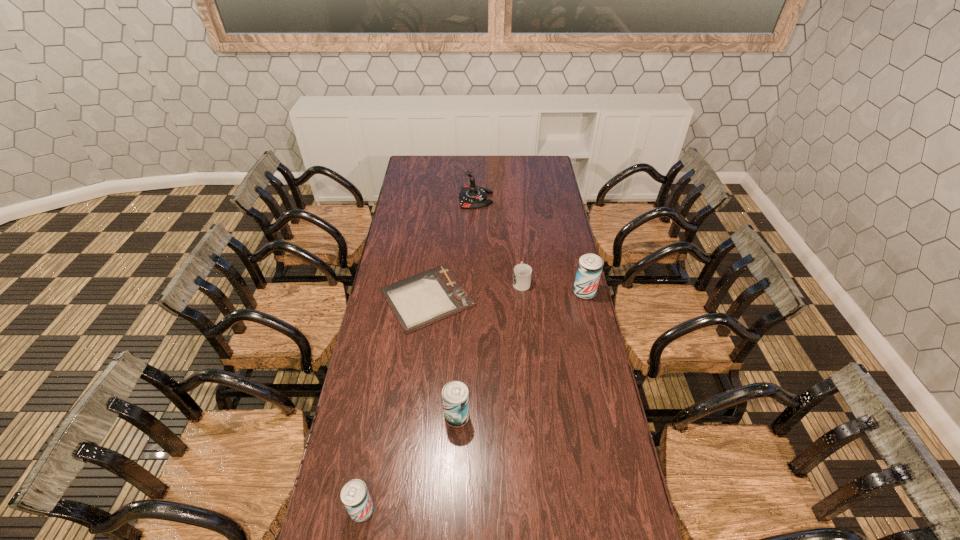
Where is `vacant position for inserting another beer_can evenly`? The width and height of the screenshot is (960, 540). vacant position for inserting another beer_can evenly is located at coordinates (529, 347).